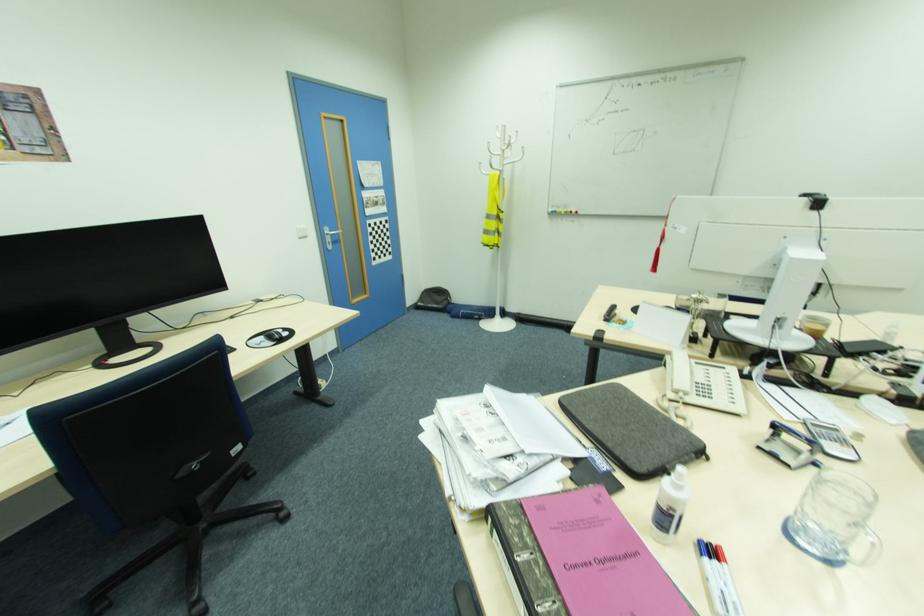
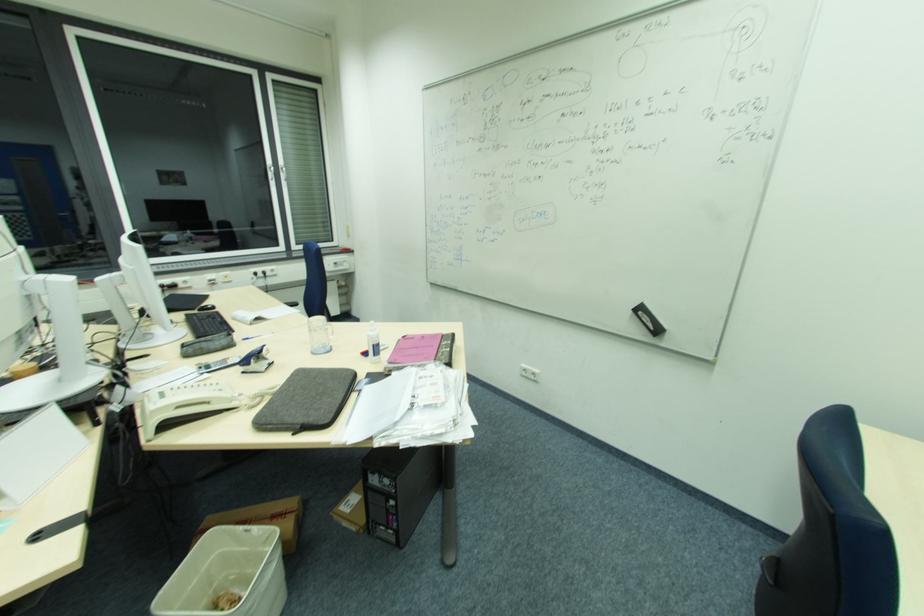
In the second image, find the point that corresponds to [612,445] in the first image.

(350, 382)